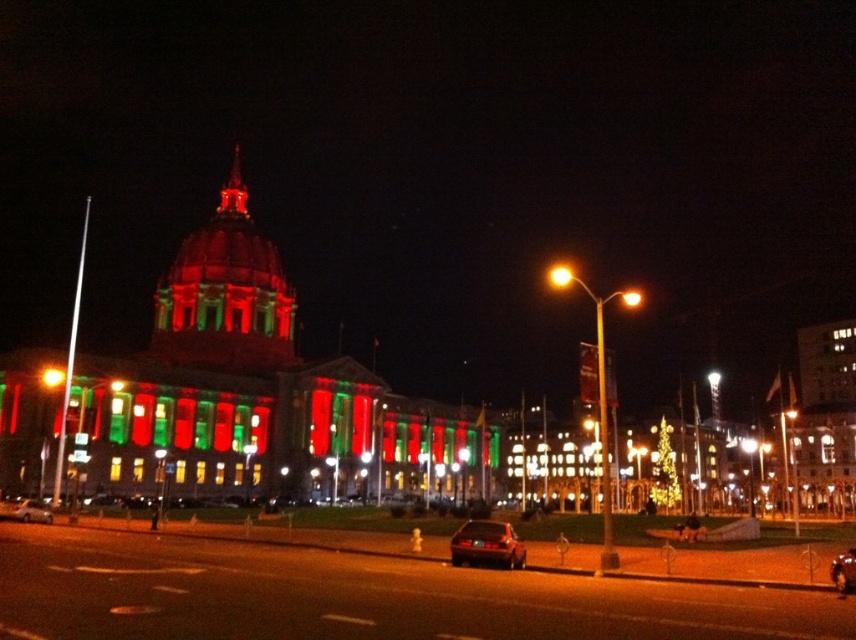
You are standing on the sidewalk in front of the grand building. You see the shiny black sedan at lower center and the metallic silver car at center. Which car is closer to you?

The shiny black sedan at lower center is closer to the viewer than the metallic silver car at center.

Looking at this image, you are standing at the entrance of the grand building and want to park your metallic silver car at center. Based on the image, is there enough space to park the car between the fire hydrant and the curb?

The metallic silver car at center is located at point coordinates, but without specific measurements of the space between the fire hydrant and curb, it is impossible to determine if there is enough space to park the car there. More information about the distance between these objects is needed to answer accurately.

You are a pedestrian standing on the sidewalk in front of the grand building. You see two cars in the street, the metallic silver car at center and the shiny metallic car at center. Which car is closer to you?

The metallic silver car at center is closer to you because it is further to the viewer than the shiny metallic car at center.